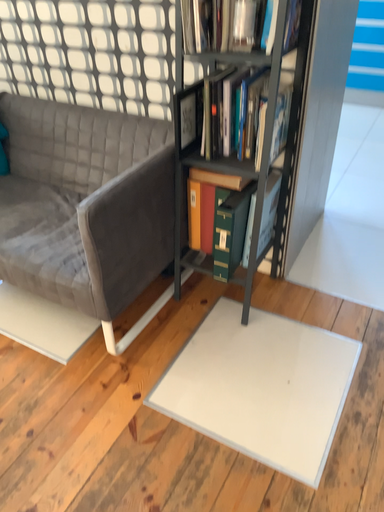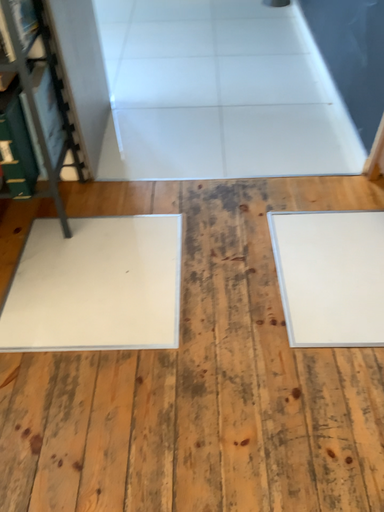
Question: How did the camera likely rotate when shooting the video?

Choices:
 (A) rotated right
 (B) rotated left

Answer: (A)